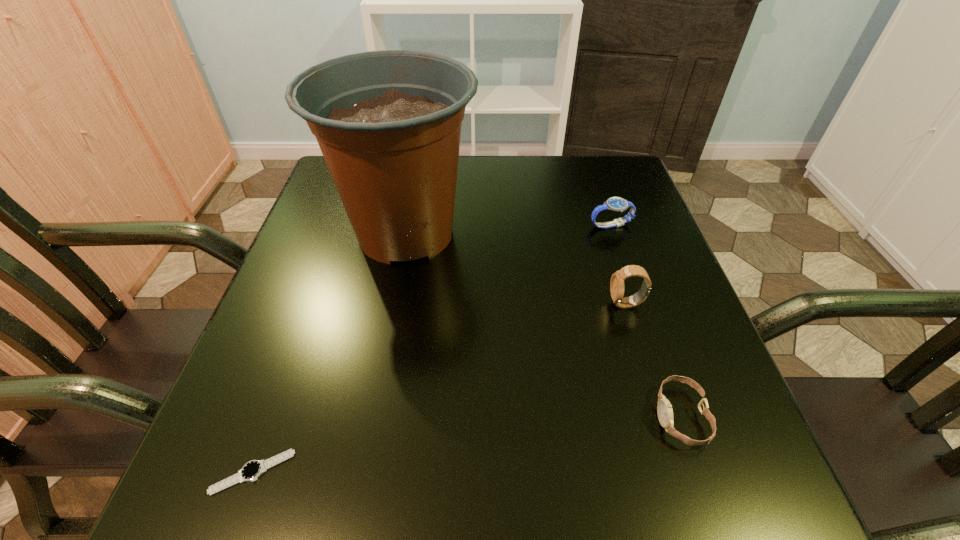
Locate which object is the closest to the second shortest object. Please provide its 2D coordinates. Your answer should be formatted as a tuple, i.e. [(x, y)], where the tuple contains the x and y coordinates of a point satisfying the conditions above.

[(617, 287)]

Locate an element on the screen. object that ranks as the closest to the tallest watch is located at coordinates (664, 409).

Locate which watch ranks third in proximity to the fourth shortest object. Please provide its 2D coordinates. Your answer should be formatted as a tuple, i.e. [(x, y)], where the tuple contains the x and y coordinates of a point satisfying the conditions above.

[(251, 471)]

This screenshot has width=960, height=540. Identify the location of the closest watch to the shortest object. (664, 409).

I want to click on free location that satisfies the following two spatial constraints: 1. on the back side of the tallest object; 2. on the right side of the shortest object, so click(x=338, y=233).

The height and width of the screenshot is (540, 960). What are the coordinates of `free spot that satisfies the following two spatial constraints: 1. on the back side of the shortest object; 2. on the right side of the flowerpot` in the screenshot? It's located at (338, 233).